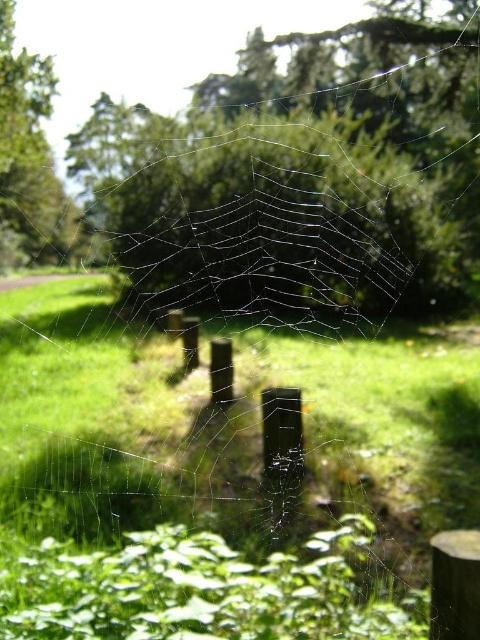
Is transparent web at center positioned in front of green leafy tree at upper left?

Yes, transparent web at center is in front of green leafy tree at upper left.

Identify the location of transparent web at center. (288, 176).

The height and width of the screenshot is (640, 480). Identify the location of transparent web at center. [288, 176].

Is the position of green grass at center more distant than that of transparent web at center?

No, it is in front of transparent web at center.

Who is higher up, green grass at center or transparent web at center?

transparent web at center

Is point (327, 484) behind point (324, 202)?

No, (327, 484) is closer to viewer.

The width and height of the screenshot is (480, 640). I want to click on green grass at center, so click(222, 477).

Does green grass at center have a larger size compared to green leafy tree at upper left?

Yes, green grass at center is bigger than green leafy tree at upper left.

Is green grass at center smaller than green leafy tree at upper left?

Incorrect, green grass at center is not smaller in size than green leafy tree at upper left.

Measure the distance between green grass at center and camera.

They are 3.18 meters apart.

This screenshot has width=480, height=640. I want to click on green grass at center, so click(222, 477).